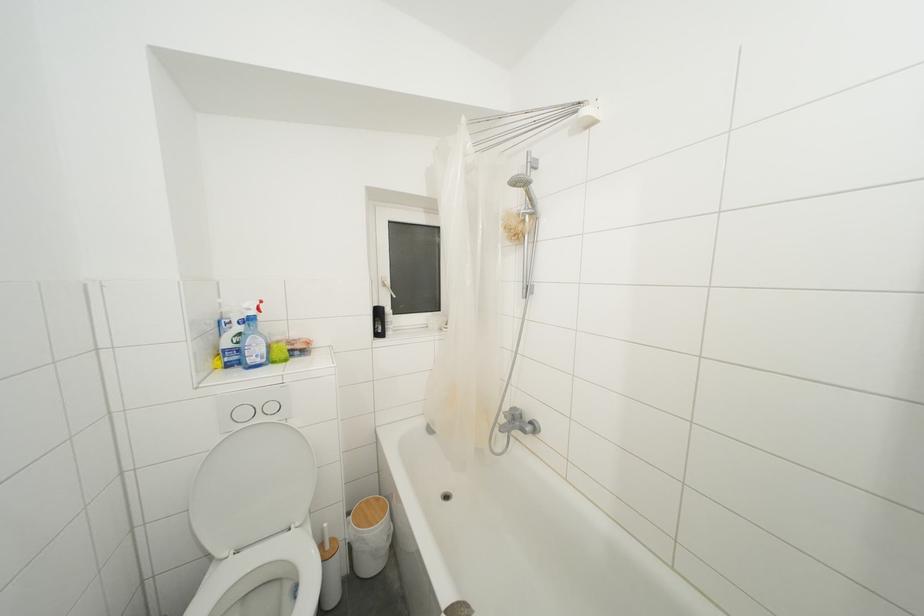
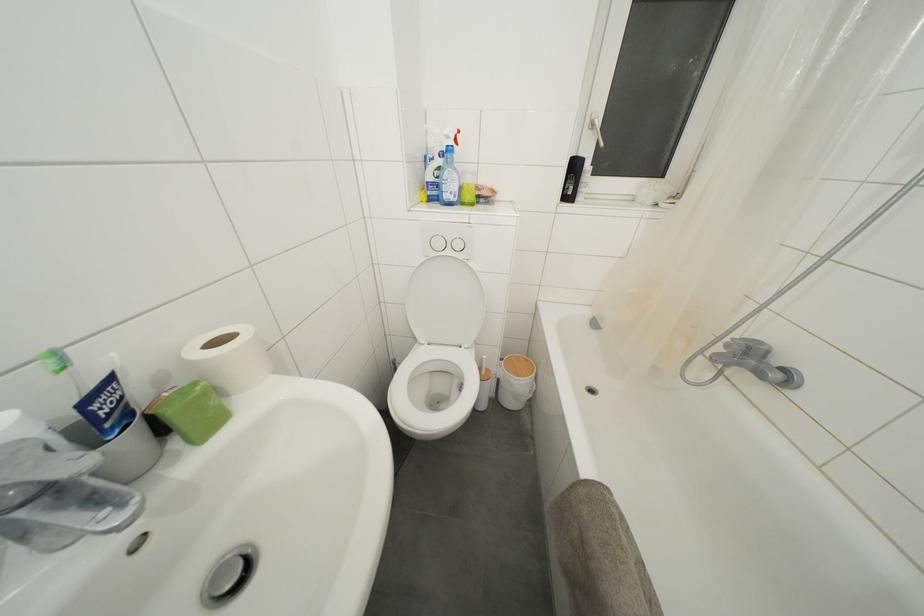
The point at [388,290] is marked in the first image. Where is the corresponding point in the second image?

(597, 131)